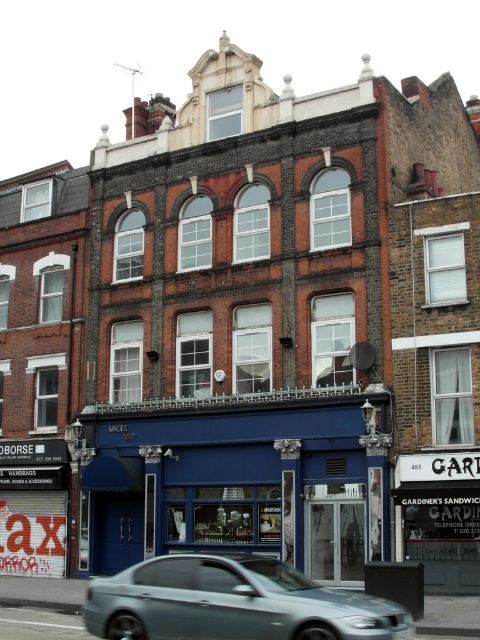
You are standing at point (203, 465) and want to enter the shop with the dark blue awning labeled

The distance between you and the shop is 46.17 meters, so you can easily walk to it.

Based on the photo, you are a delivery person trying to park your 2.5 meter wide van next to the blue matte storefront at center. The space available is between the storefront and the metallic silver sedan at center. Can your van fit in that space?

The blue matte storefront at center is wider than the metallic silver sedan at center, so the space between them may be sufficient for your 2.5 meter wide van. However, without knowing the exact dimensions of the space, it is recommended to measure before attempting to park.

You are a delivery person trying to deliver a package to the blue matte storefront at center. You see the metallic silver sedan at center blocking the entrance. Can you still access the storefront?

The blue matte storefront at center is located above the metallic silver sedan at center, so the sedan is parked below it. Since the storefront is above, you can still access it without moving the sedan.